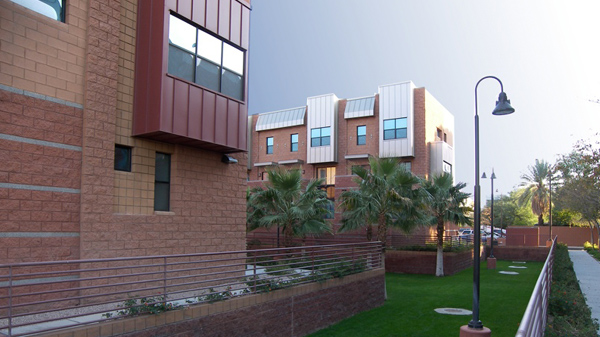
Where is `windows`? The height and width of the screenshot is (337, 600). windows is located at coordinates (54, 11), (187, 60), (270, 145), (293, 142), (319, 139), (363, 135), (399, 129).